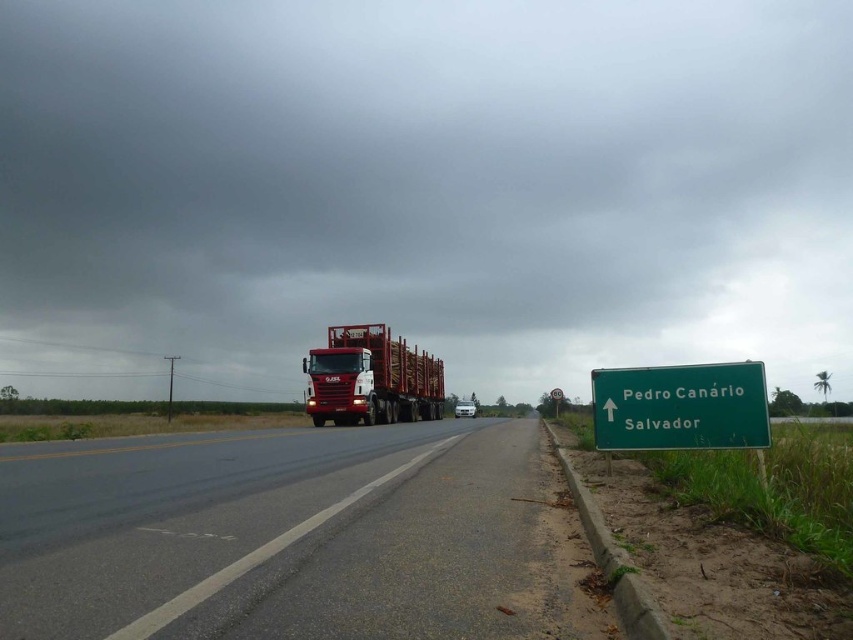
Question: Can you confirm if dark gray cloud at upper center is positioned below metallic red trailer truck at center?

Choices:
 (A) no
 (B) yes

Answer: (A)

Question: Among these objects, which one is nearest to the camera?

Choices:
 (A) dark gray cloud at upper center
 (B) black asphalt road at center
 (C) green matte sign at right

Answer: (B)

Question: Which object is closer to the camera taking this photo?

Choices:
 (A) metallic red trailer truck at center
 (B) black asphalt road at center

Answer: (B)

Question: From the image, what is the correct spatial relationship of dark gray cloud at upper center in relation to metallic red trailer truck at center?

Choices:
 (A) left
 (B) right

Answer: (A)

Question: From the image, what is the correct spatial relationship of dark gray cloud at upper center in relation to green matte sign at right?

Choices:
 (A) left
 (B) right

Answer: (A)

Question: Which is farther from the metallic red trailer truck at center?

Choices:
 (A) green matte sign at right
 (B) black asphalt road at center
 (C) dark gray cloud at upper center

Answer: (C)